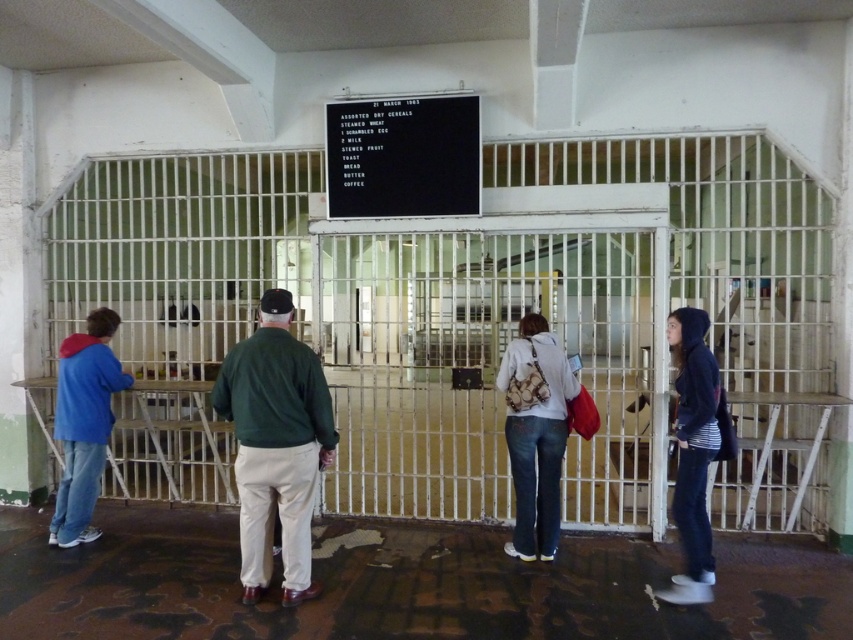
Is point (100, 380) more distant than point (701, 362)?

Yes, point (100, 380) is farther from viewer.

Which is in front, point (99, 404) or point (701, 497)?

Point (701, 497) is in front.

Between point (68, 500) and point (709, 371), which one is positioned in front?

Point (709, 371) is more forward.

This screenshot has width=853, height=640. Find the location of `blue fleece jacket at left`. blue fleece jacket at left is located at coordinates (84, 422).

Is green sweater at center thinner than blue fleece jacket at left?

Incorrect, green sweater at center's width is not less than blue fleece jacket at left's.

Does green sweater at center appear under blue fleece jacket at left?

No.

Which is behind, point (292, 531) or point (114, 321)?

Point (114, 321)

At what (x,y) coordinates should I click in order to perform the action: click on green sweater at center. Please return your answer as a coordinate pair (x, y). This screenshot has width=853, height=640. Looking at the image, I should click on (276, 442).

Is point (424, 164) positioned in front of point (53, 531)?

That is False.

Is black matte signboard at center to the right of blue fleece jacket at left from the viewer's perspective?

Correct, you'll find black matte signboard at center to the right of blue fleece jacket at left.

Find the location of a particular element. black matte signboard at center is located at coordinates pos(402,156).